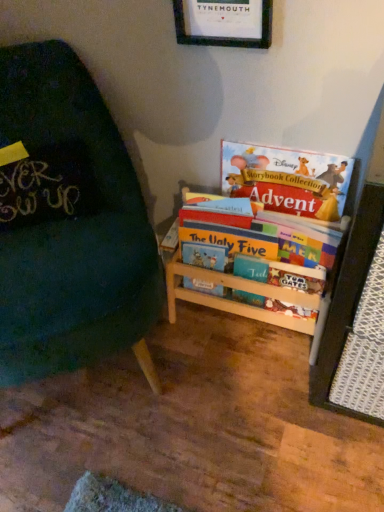
Question: From the image's perspective, is multicolored cardboard bookshelf at right, the 1th book positioned from the bottom, located beneath wooden picture frame at upper center?

Choices:
 (A) no
 (B) yes

Answer: (B)

Question: From a real-world perspective, does multicolored cardboard bookshelf at right, the 1th book positioned from the bottom, sit lower than wooden picture frame at upper center?

Choices:
 (A) yes
 (B) no

Answer: (A)

Question: Is multicolored cardboard bookshelf at right, the 1th book positioned from the bottom, positioned behind wooden picture frame at upper center?

Choices:
 (A) no
 (B) yes

Answer: (B)

Question: Considering the relative sizes of multicolored cardboard bookshelf at right, the 1th book positioned from the bottom, and wooden picture frame at upper center in the image provided, is multicolored cardboard bookshelf at right, the 1th book positioned from the bottom, shorter than wooden picture frame at upper center?

Choices:
 (A) no
 (B) yes

Answer: (A)

Question: Does multicolored cardboard bookshelf at right, which is counted as the 2th book, starting from the top, come in front of wooden picture frame at upper center?

Choices:
 (A) yes
 (B) no

Answer: (B)

Question: Is green fabric chair at left wider or thinner than multicolored cardboard bookshelf at right, which is counted as the 2th book, starting from the top?

Choices:
 (A) thin
 (B) wide

Answer: (B)

Question: Is green fabric chair at left inside or outside of multicolored cardboard bookshelf at right, the 1th book positioned from the bottom?

Choices:
 (A) inside
 (B) outside

Answer: (B)

Question: Is green fabric chair at left to the left or to the right of multicolored cardboard bookshelf at right, which is counted as the 2th book, starting from the top, in the image?

Choices:
 (A) left
 (B) right

Answer: (A)

Question: Is point (107, 160) positioned closer to the camera than point (190, 197)?

Choices:
 (A) farther
 (B) closer

Answer: (B)

Question: From a real-world perspective, is matte paper book at upper right, positioned as the first book in top-to-bottom order, physically located above or below wooden picture frame at upper center?

Choices:
 (A) below
 (B) above

Answer: (A)

Question: Based on their positions, is matte paper book at upper right, positioned as the first book in top-to-bottom order, located to the left or right of wooden picture frame at upper center?

Choices:
 (A) left
 (B) right

Answer: (B)

Question: Considering the positions of matte paper book at upper right, positioned as the first book in top-to-bottom order, and wooden picture frame at upper center in the image, is matte paper book at upper right, positioned as the first book in top-to-bottom order, taller or shorter than wooden picture frame at upper center?

Choices:
 (A) tall
 (B) short

Answer: (B)

Question: In terms of size, does matte paper book at upper right, positioned as the first book in top-to-bottom order, appear bigger or smaller than wooden picture frame at upper center?

Choices:
 (A) big
 (B) small

Answer: (A)

Question: Is matte paper book at upper right, the 2th book ordered from the bottom, wider or thinner than wooden bookshelf at center?

Choices:
 (A) wide
 (B) thin

Answer: (B)

Question: Looking at the image, does matte paper book at upper right, the 2th book ordered from the bottom, seem bigger or smaller compared to wooden bookshelf at center?

Choices:
 (A) big
 (B) small

Answer: (B)